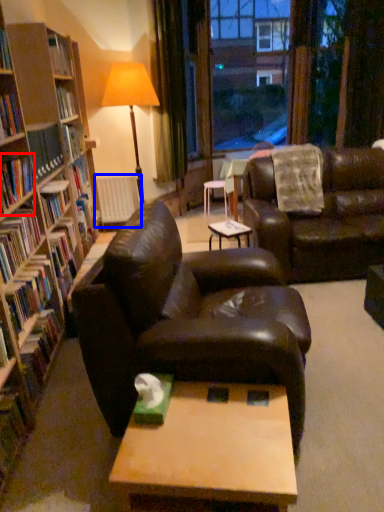
Question: Which of the following is the closest to the observer, book (highlighted by a red box) or radiator (highlighted by a blue box)?

Choices:
 (A) book
 (B) radiator

Answer: (A)